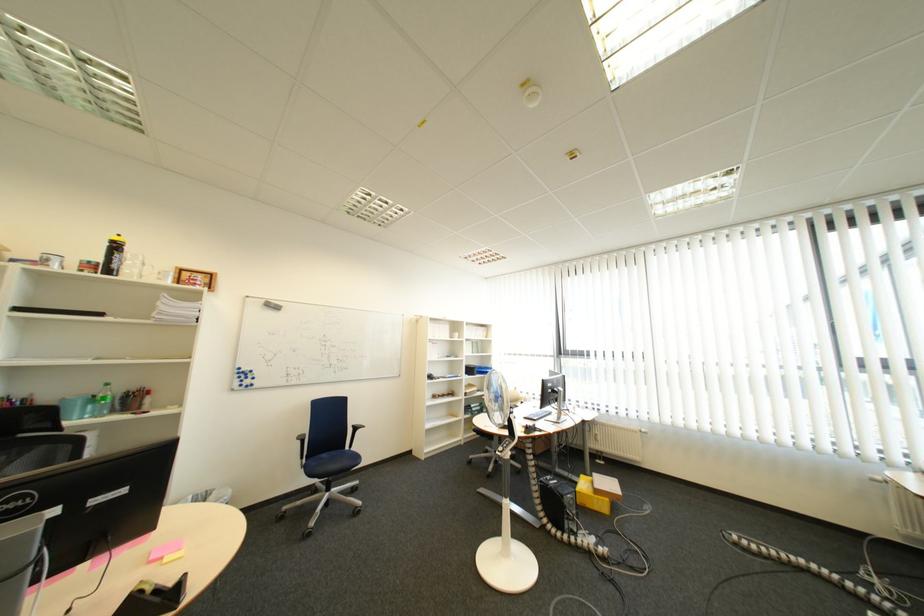
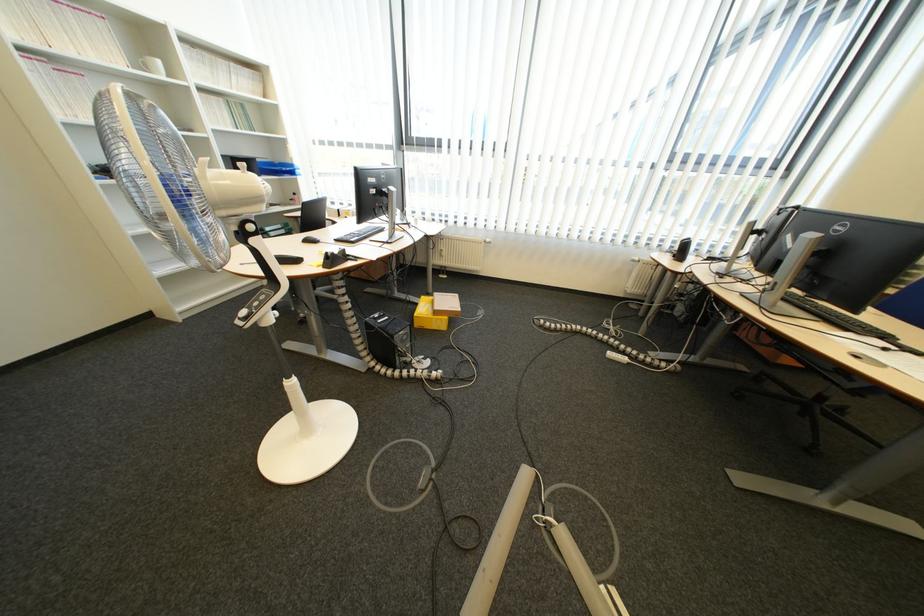
Where in the second image is the point corresponding to pixel 882 586 from the first image?

(619, 331)